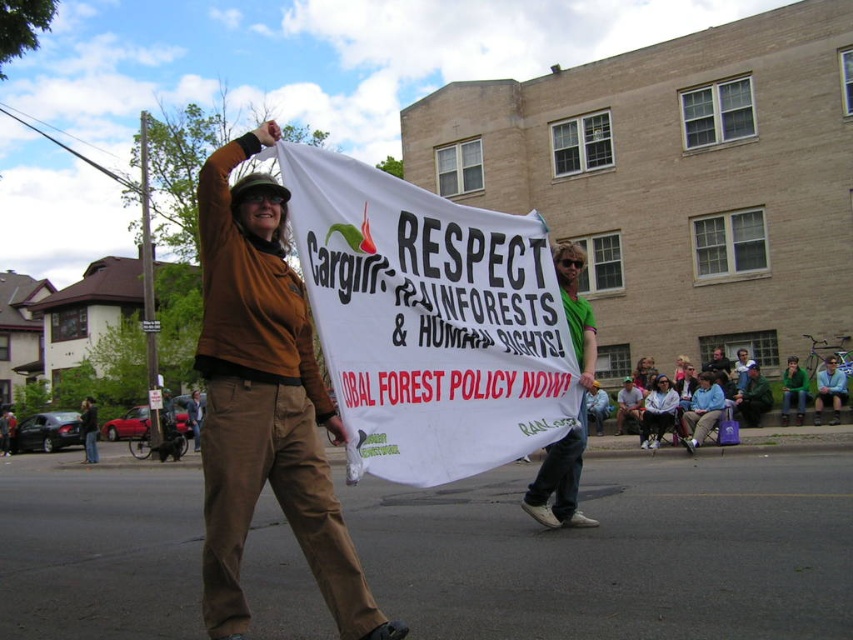
Based on the scene description, if you were standing at the lower right corner of the image, which object would be closer to you between the green fuzzy sweater at lower right and the brown leather jacket at center?

The green fuzzy sweater at lower right is above the brown leather jacket at center, so the green fuzzy sweater at lower right is closer to you.

You are a photographer trying to capture a clear photo of the white paper banner at center and the brown fabric pants at center. Since you want to ensure both are visible, which object should you focus on first considering their sizes?

The white paper banner at center has a smaller width than the brown fabric pants at center, so you should focus on the brown fabric pants at center first as it is larger and will be easier to capture clearly.

You are a photographer at the protest scene. You want to capture a photo where the white paper banner at center is clearly visible without being blocked by the brown fabric pants at center. Based on their positions, is this possible?

The white paper banner at center is located above the brown fabric pants at center, so yes, the photographer can capture the white paper banner at center without obstruction from the brown fabric pants at center.